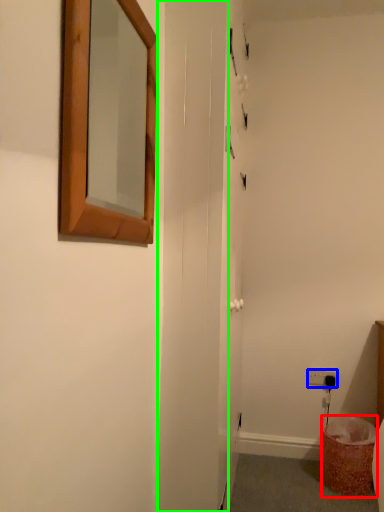
Question: Which object is positioned farthest from laundry basket (highlighted by a red box)? Select from electric outlet (highlighted by a blue box) and screen door (highlighted by a green box).

Choices:
 (A) electric outlet
 (B) screen door

Answer: (B)